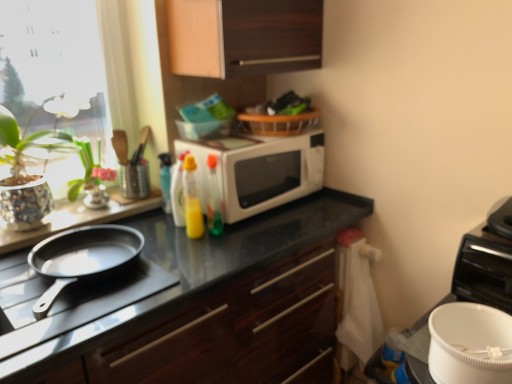
Image resolution: width=512 pixels, height=384 pixels. What are the coordinates of `free space in front of white glossy microwave at center` in the screenshot? It's located at (242, 241).